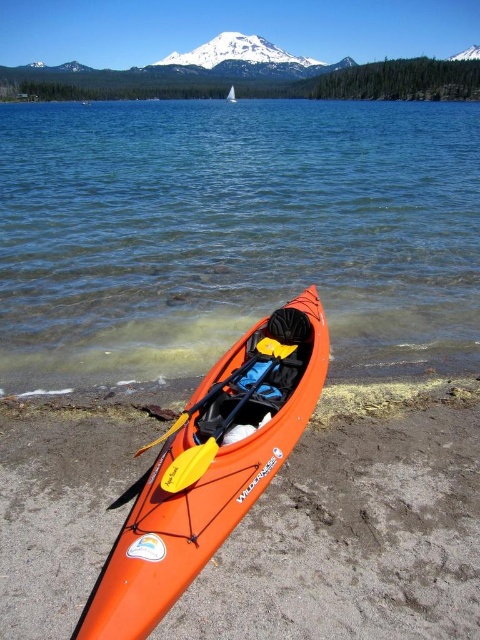
Is point (279, 348) less distant than point (180, 419)?

No, (279, 348) is behind (180, 419).

The width and height of the screenshot is (480, 640). What are the coordinates of `yellow plastic paddle at center` in the screenshot? It's located at (190, 465).

The height and width of the screenshot is (640, 480). Describe the element at coordinates (190, 465) in the screenshot. I see `yellow plastic paddle at center` at that location.

The image size is (480, 640). Find the location of `yellow plastic paddle at center`. yellow plastic paddle at center is located at coordinates point(190,465).

What do you see at coordinates (212, 468) in the screenshot? This screenshot has height=640, width=480. I see `orange matte kayak at lower left` at bounding box center [212, 468].

Which is more to the right, orange matte kayak at lower left or yellow plastic paddle at center?

From the viewer's perspective, yellow plastic paddle at center appears more on the right side.

Describe the element at coordinates (212, 468) in the screenshot. I see `orange matte kayak at lower left` at that location.

Image resolution: width=480 pixels, height=640 pixels. I want to click on orange matte kayak at lower left, so click(212, 468).

Can you confirm if orange plastic kayak at lower center is shorter than yellow plastic paddle at center?

Incorrect, orange plastic kayak at lower center's height does not fall short of yellow plastic paddle at center's.

Who is positioned more to the left, orange plastic kayak at lower center or yellow plastic paddle at center?

yellow plastic paddle at center

Is point (83, 328) farther from camera compared to point (178, 484)?

Yes, it is behind point (178, 484).

Find the location of a particular element. The width and height of the screenshot is (480, 640). orange plastic kayak at lower center is located at coordinates (232, 232).